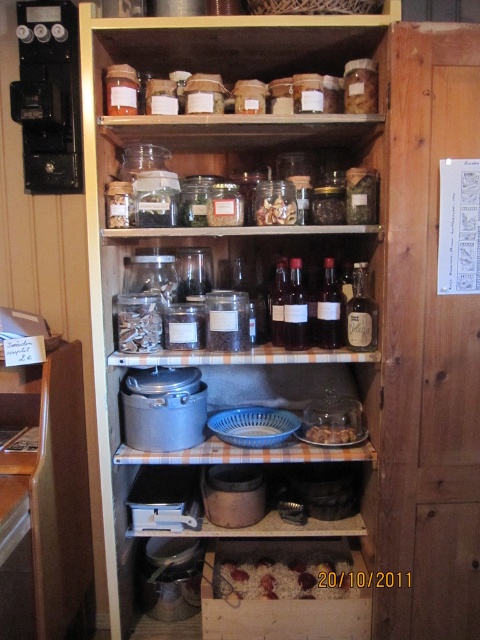
Question: Does clear glass bottles at center have a lesser width compared to translucent glass jar at lower center?

Choices:
 (A) yes
 (B) no

Answer: (B)

Question: Which point is closer to the camera taking this photo?

Choices:
 (A) (284, 186)
 (B) (308, 428)

Answer: (A)

Question: Which of the following is the farthest from the observer?

Choices:
 (A) (187, 349)
 (B) (349, 429)

Answer: (B)

Question: Can you confirm if clear glass bottles at center is positioned below translucent glass jar at lower center?

Choices:
 (A) no
 (B) yes

Answer: (A)

Question: Does clear glass jars at upper center lie in front of clear glass bottles at center?

Choices:
 (A) no
 (B) yes

Answer: (B)

Question: Among these points, which one is farthest from the camera?

Choices:
 (A) (343, 433)
 (B) (300, 353)

Answer: (A)